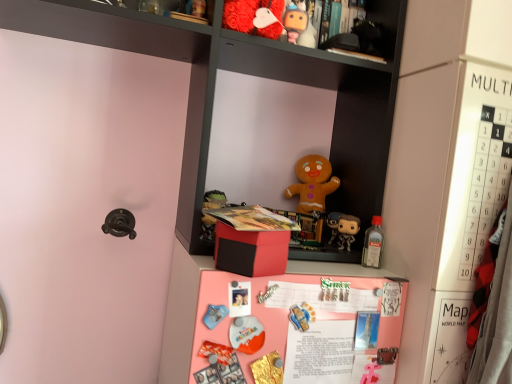
Question: Is pink matte board at center oriented away from matte gingerbread man at center, the 7th toy from the front?

Choices:
 (A) yes
 (B) no

Answer: (B)

Question: Is pink matte board at center wider than matte gingerbread man at center, arranged as the first toy when viewed from the back?

Choices:
 (A) no
 (B) yes

Answer: (B)

Question: From a real-world perspective, is pink matte board at center physically above matte gingerbread man at center, arranged as the first toy when viewed from the back?

Choices:
 (A) no
 (B) yes

Answer: (A)

Question: Is pink matte board at center facing towards matte gingerbread man at center, acting as the fifth toy starting from the bottom?

Choices:
 (A) yes
 (B) no

Answer: (B)

Question: Is pink matte board at center positioned beyond the bounds of matte gingerbread man at center, the 7th toy from the front?

Choices:
 (A) no
 (B) yes

Answer: (B)

Question: Considering the positions of metallic silver toy at center, placed as the 7th toy when sorted from top to bottom, and matte gingerbread man at center, the 7th toy from the front, in the image, is metallic silver toy at center, placed as the 7th toy when sorted from top to bottom, taller or shorter than matte gingerbread man at center, the 7th toy from the front,?

Choices:
 (A) tall
 (B) short

Answer: (B)

Question: Is metallic silver toy at center, the 1th toy in the bottom-to-top sequence, to the left or to the right of matte gingerbread man at center, acting as the fifth toy starting from the bottom, in the image?

Choices:
 (A) left
 (B) right

Answer: (B)

Question: Considering their positions, is metallic silver toy at center, the 1th toy in the bottom-to-top sequence, located in front of or behind matte gingerbread man at center, arranged as the first toy when viewed from the back?

Choices:
 (A) behind
 (B) front

Answer: (B)

Question: From a real-world perspective, is metallic silver toy at center, the 1th toy in the bottom-to-top sequence, above or below matte gingerbread man at center, the 7th toy from the front?

Choices:
 (A) below
 (B) above

Answer: (A)

Question: From a real-world perspective, relative to metallic silver toy at center, placed as the 7th toy when sorted from top to bottom, is matte black cabinet at upper center vertically above or below?

Choices:
 (A) below
 (B) above

Answer: (B)

Question: Would you say matte black cabinet at upper center is to the left or to the right of metallic silver toy at center, acting as the third toy starting from the front, in the picture?

Choices:
 (A) right
 (B) left

Answer: (B)

Question: Is matte black cabinet at upper center inside the boundaries of metallic silver toy at center, the 1th toy in the bottom-to-top sequence, or outside?

Choices:
 (A) outside
 (B) inside

Answer: (A)

Question: Considering their positions, is matte black cabinet at upper center located in front of or behind metallic silver toy at center, acting as the third toy starting from the front?

Choices:
 (A) front
 (B) behind

Answer: (A)

Question: From a real-world perspective, is matte gingerbread man at center, acting as the fifth toy starting from the bottom, physically located above or below translucent plastic bottle at upper right, the 3th toy from the bottom?

Choices:
 (A) above
 (B) below

Answer: (A)

Question: In terms of height, does matte gingerbread man at center, the 7th toy from the front, look taller or shorter compared to translucent plastic bottle at upper right, the 3th toy from the bottom?

Choices:
 (A) short
 (B) tall

Answer: (B)